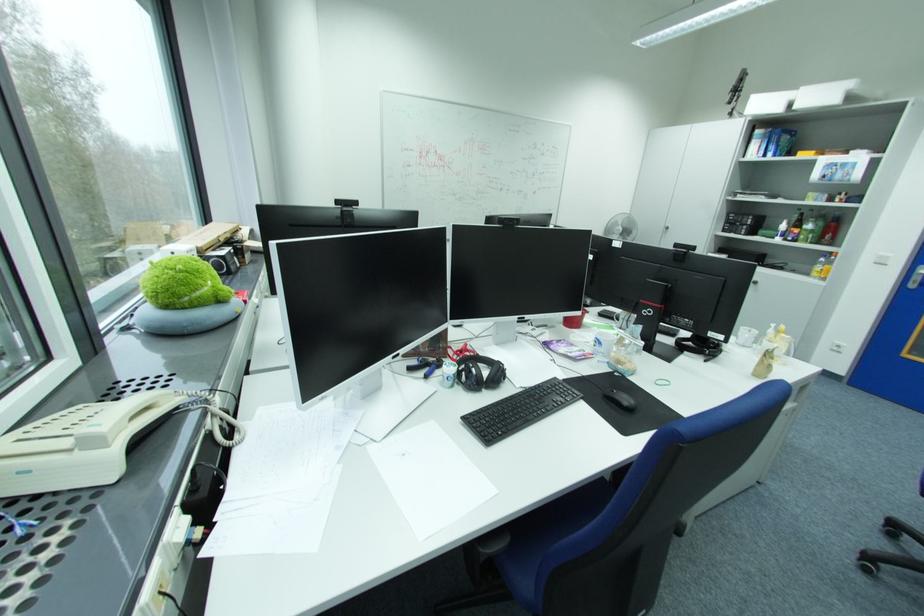
The height and width of the screenshot is (616, 924). Find the location of `blue handled tool`. blue handled tool is located at coordinates (424, 365).